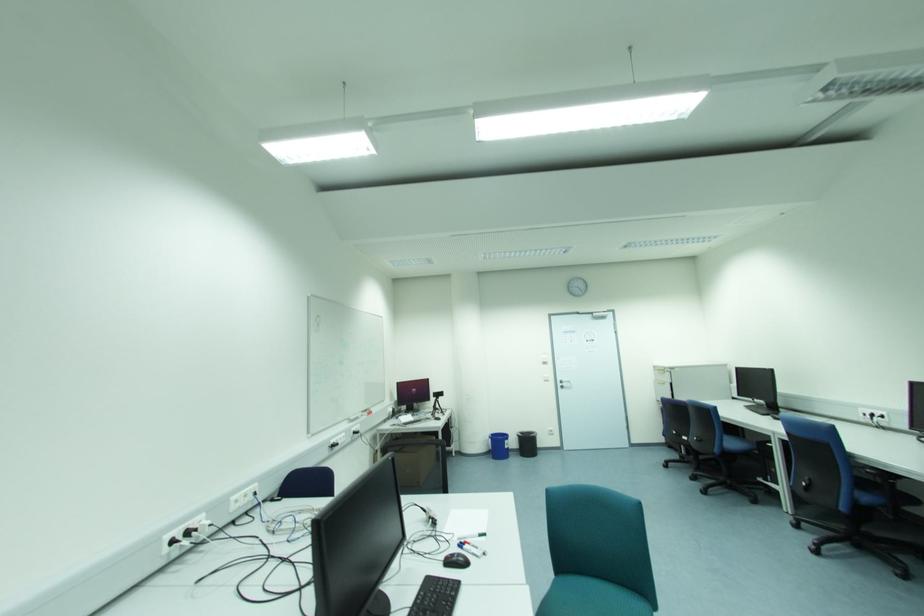
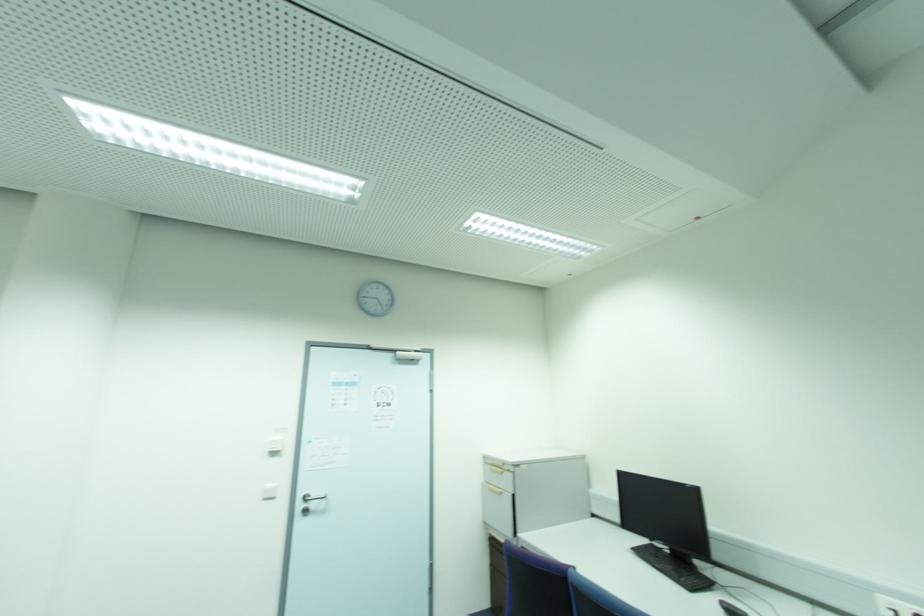
In the second image, find the point that corresponds to pixel 664 373 in the first image.

(503, 472)